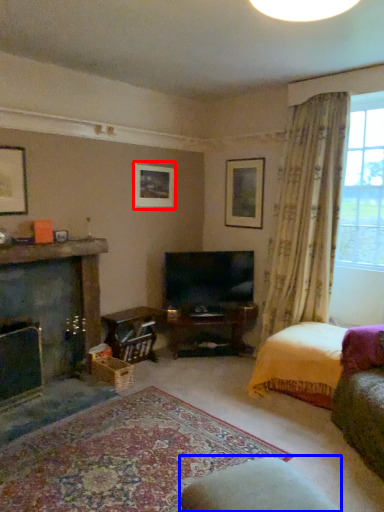
Question: Which point is closer to the camera, picture frame (highlighted by a red box) or rocking chair (highlighted by a blue box)?

Choices:
 (A) picture frame
 (B) rocking chair

Answer: (B)